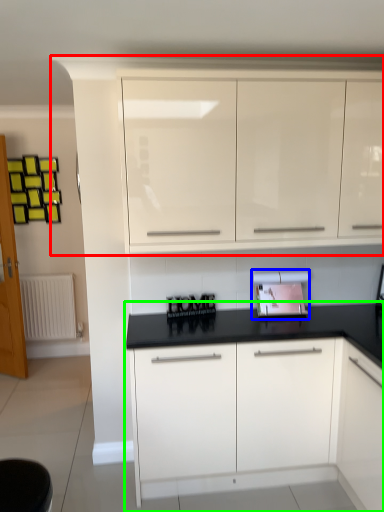
Question: Which is nearer to the cabinetry (highlighted by a red box)? appliance (highlighted by a blue box) or cabinetry (highlighted by a green box).

Choices:
 (A) appliance
 (B) cabinetry

Answer: (A)